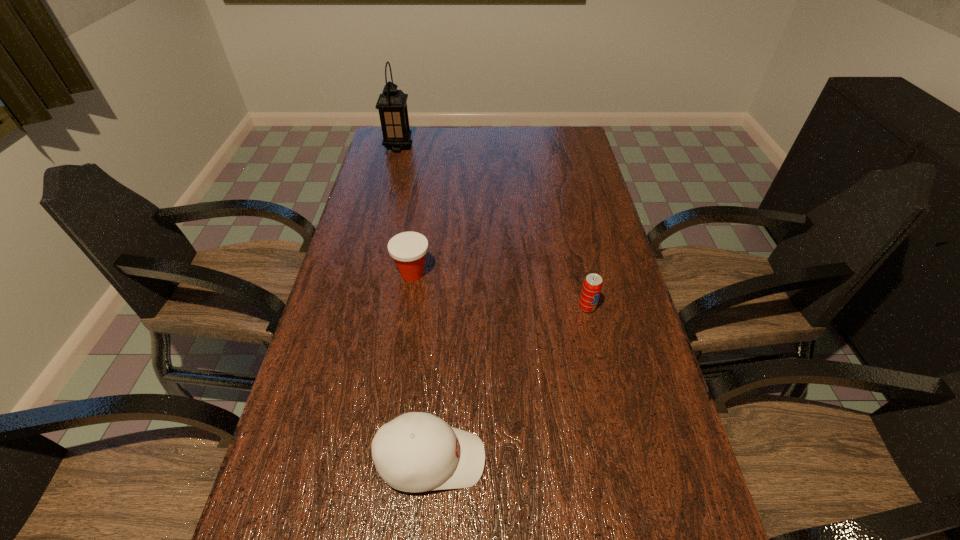
You are a GUI agent. You are given a task and a screenshot of the screen. Output one action in this format:
    pyautogui.click(x=<x>, y=<y>)
    Task: Click on the vacant space that is in between the soda can and the baseball cap
    The width and height of the screenshot is (960, 540).
    Given the screenshot: What is the action you would take?
    pyautogui.click(x=509, y=383)

Where is `blank region between the lantern and the baseball cap`? The width and height of the screenshot is (960, 540). blank region between the lantern and the baseball cap is located at coordinates (415, 303).

Where is `vacant region between the nearest object and the tallest object`? This screenshot has height=540, width=960. vacant region between the nearest object and the tallest object is located at coordinates (415, 303).

Locate an element on the screen. vacant space in between the leftmost object and the soda can is located at coordinates (492, 227).

I want to click on vacant area between the third farthest object and the baseball cap, so click(x=509, y=383).

Locate an element on the screen. vacant point located between the Dixie cup and the soda can is located at coordinates (499, 291).

I want to click on free spot between the farthest object and the baseball cap, so click(x=415, y=303).

Identify which object is the nearest to the nearest object. Please provide its 2D coordinates. Your answer should be formatted as a tuple, i.e. [(x, y)], where the tuple contains the x and y coordinates of a point satisfying the conditions above.

[(592, 285)]

Select which object is the third closest to the third farthest object. Please provide its 2D coordinates. Your answer should be formatted as a tuple, i.e. [(x, y)], where the tuple contains the x and y coordinates of a point satisfying the conditions above.

[(392, 104)]

Where is `vacant position in the image that satisfies the following two spatial constraints: 1. on the front side of the tallest object; 2. on the left side of the second farthest object`? vacant position in the image that satisfies the following two spatial constraints: 1. on the front side of the tallest object; 2. on the left side of the second farthest object is located at coordinates (367, 273).